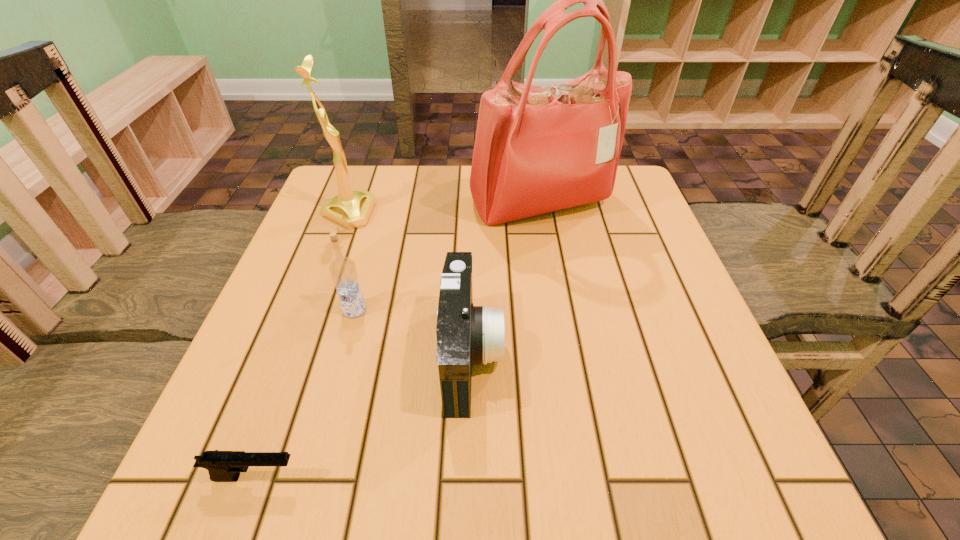
At what (x,y) coordinates should I click in order to perform the action: click on free space located on the front-facing side of the shortest object. Please return your answer as a coordinate pair (x, y). Image resolution: width=960 pixels, height=540 pixels. Looking at the image, I should click on (570, 477).

You are a GUI agent. You are given a task and a screenshot of the screen. Output one action in this format:
    pyautogui.click(x=<x>, y=<y>)
    Task: Click on the handbag present at the far edge
    The width and height of the screenshot is (960, 540).
    Given the screenshot: What is the action you would take?
    pyautogui.click(x=538, y=149)

Image resolution: width=960 pixels, height=540 pixels. I want to click on award situated at the far edge, so click(351, 209).

Locate an element on the screen. This screenshot has width=960, height=540. object positioned at the near edge is located at coordinates (223, 466).

The width and height of the screenshot is (960, 540). I want to click on award situated at the left edge, so click(351, 209).

You are a GUI agent. You are given a task and a screenshot of the screen. Output one action in this format:
    pyautogui.click(x=<x>, y=<y>)
    Task: Click on the vodka located in the left edge section of the desktop
    This screenshot has width=960, height=540.
    Given the screenshot: What is the action you would take?
    pyautogui.click(x=343, y=271)

At what (x,y) coordinates should I click in order to perform the action: click on pistol that is at the left edge. Please return your answer as a coordinate pair (x, y). The height and width of the screenshot is (540, 960). Looking at the image, I should click on (223, 466).

What are the coordinates of `object positioned at the right edge` in the screenshot? It's located at (538, 149).

Locate an element on the screen. object located at the far left corner is located at coordinates pos(351,209).

Locate an element on the screen. This screenshot has width=960, height=540. object situated at the near left corner is located at coordinates (223, 466).